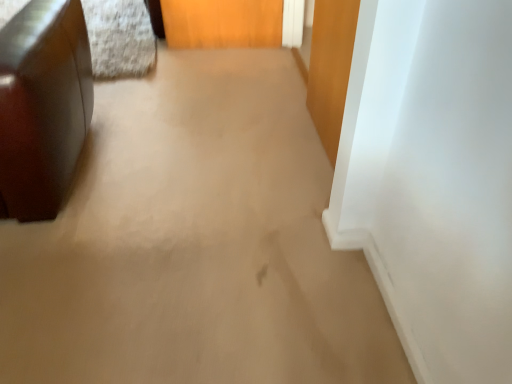
Question: From a real-world perspective, is glossy brown ottoman at left physically located above or below wooden door at upper right?

Choices:
 (A) above
 (B) below

Answer: (A)

Question: Is glossy brown ottoman at left wider or thinner than wooden door at upper right?

Choices:
 (A) thin
 (B) wide

Answer: (B)

Question: From their relative heights in the image, would you say glossy brown ottoman at left is taller or shorter than wooden door at upper right?

Choices:
 (A) tall
 (B) short

Answer: (A)

Question: In the image, is wooden door at upper right on the left side or the right side of glossy brown ottoman at left?

Choices:
 (A) left
 (B) right

Answer: (B)

Question: From the image's perspective, is wooden door at upper right above or below glossy brown ottoman at left?

Choices:
 (A) above
 (B) below

Answer: (A)

Question: Looking at the image, does wooden door at upper right seem bigger or smaller compared to glossy brown ottoman at left?

Choices:
 (A) big
 (B) small

Answer: (B)

Question: Is wooden door at upper right situated inside glossy brown ottoman at left or outside?

Choices:
 (A) outside
 (B) inside

Answer: (A)